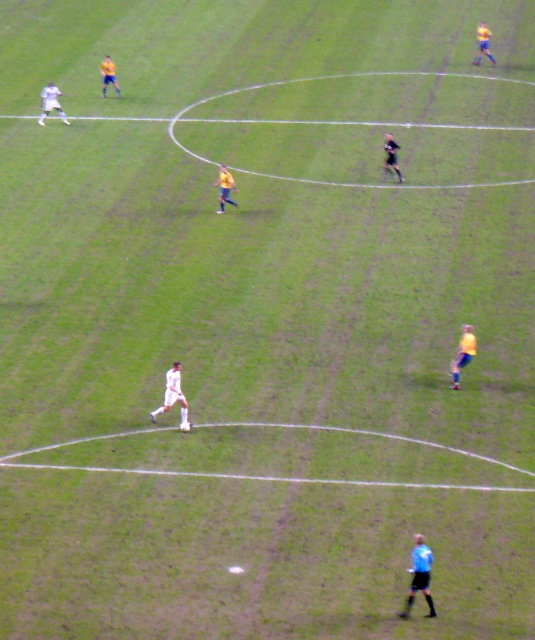
You are a soccer referee standing at the center of the field. You see a point marked at coordinates (419, 577). Which player is located at that point?

The point at coordinates (419, 577) corresponds to the blue uniformed person at lower right.

You are a soccer coach observing the match. You notice the white matte soccer player at center. Can you determine their exact position on the field using coordinates?

The white matte soccer player at center is located at coordinates point (172, 396).